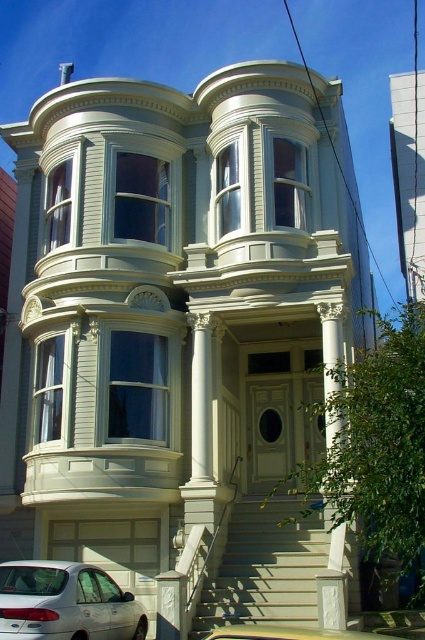
You are a delivery person trying to park your yellow matte taxi at lower center near the entrance of the Victorian house. There is a white carved column at right in the way. Can you maneuver around it easily?

The white carved column at right is smaller than the yellow matte taxi at lower center, so it might be challenging to maneuver around it easily due to the size difference.

You are standing at the front of the house and want to reach the front door. There is a point marked at coordinates point (265, 566). What is located at this point?

The point (265, 566) is occupied by smooth beige stairs at center, which lead up to the front door.

You are standing at the front entrance of the Victorian house and notice two points marked on the facade. The first point is at coordinates point (232, 509) and the second is at point (326, 616). From your perspective at the entrance, which point is closer to you?

Point (326, 616) is closer to you since it is in front of point (232, 509).